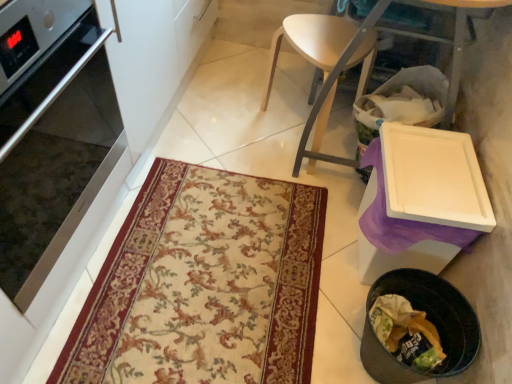
This screenshot has width=512, height=384. Identify the location of vacant area situated to the left side of white plastic cutting board at right. (220, 120).